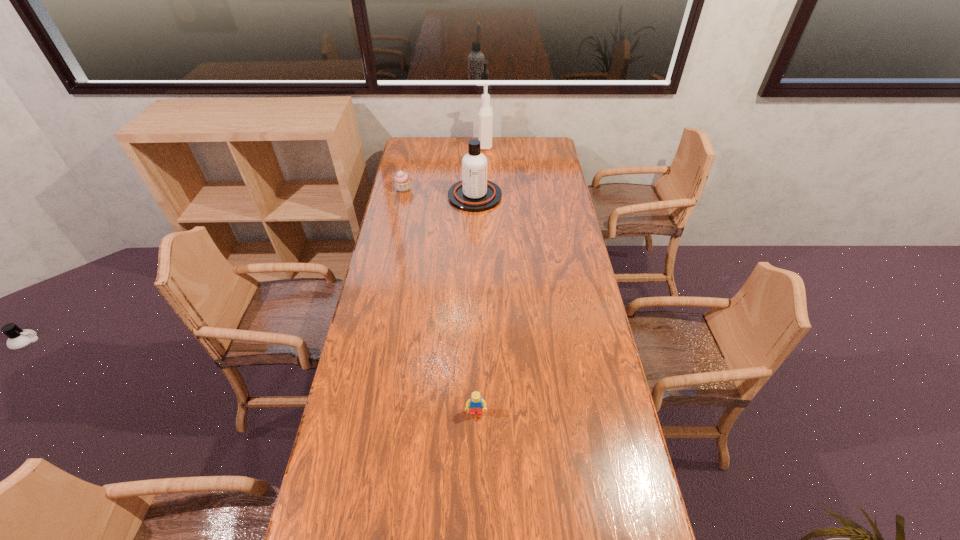
You are a GUI agent. You are given a task and a screenshot of the screen. Output one action in this format:
    pyautogui.click(x=<x>, y=<y>)
    Task: Click on the farthest object
    This screenshot has height=540, width=960.
    Given the screenshot: What is the action you would take?
    pyautogui.click(x=485, y=111)

Image resolution: width=960 pixels, height=540 pixels. I want to click on the taller cleansing agent, so click(485, 111).

The width and height of the screenshot is (960, 540). Identify the location of the third shortest object. (474, 193).

In order to click on the nearer cleansing agent in this screenshot , I will do `click(474, 193)`.

Where is `the leftmost object`? The width and height of the screenshot is (960, 540). the leftmost object is located at coordinates (402, 180).

Find the location of `Lego`. Lego is located at coordinates (475, 403).

Where is `free region located 0.150m on the front label of the tallest object`? This screenshot has width=960, height=540. free region located 0.150m on the front label of the tallest object is located at coordinates (450, 145).

Locate an element on the screen. free spot located on the front label of the tallest object is located at coordinates (406, 145).

This screenshot has width=960, height=540. Find the location of `free spot located on the front label of the tallest object`. free spot located on the front label of the tallest object is located at coordinates (463, 145).

The image size is (960, 540). In order to click on free space located 0.300m on the right of the second tallest object in this screenshot , I will do click(564, 196).